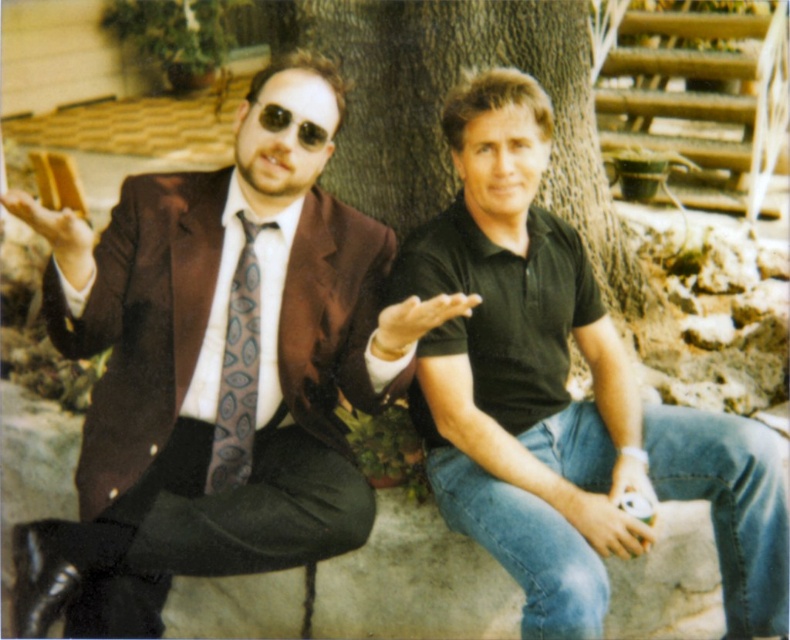
Question: Can you confirm if black matte shirt at center is positioned to the right of matte gray tie at left?

Choices:
 (A) yes
 (B) no

Answer: (A)

Question: Which point appears closest to the camera in this image?

Choices:
 (A) (593, 497)
 (B) (374, 132)

Answer: (A)

Question: Which point appears closest to the camera in this image?

Choices:
 (A) (307, 147)
 (B) (442, 90)
 (C) (241, 410)

Answer: (A)

Question: Can you confirm if brown textured tree trunk at center is smaller than matte gray tie at left?

Choices:
 (A) yes
 (B) no

Answer: (B)

Question: Is shiny brown suit at center thinner than brown textured tree trunk at center?

Choices:
 (A) no
 (B) yes

Answer: (B)

Question: Which object is positioned farthest from the matte gray tie at left?

Choices:
 (A) jeans at lower right
 (B) sunglasses at center
 (C) shiny brown suit at center

Answer: (A)